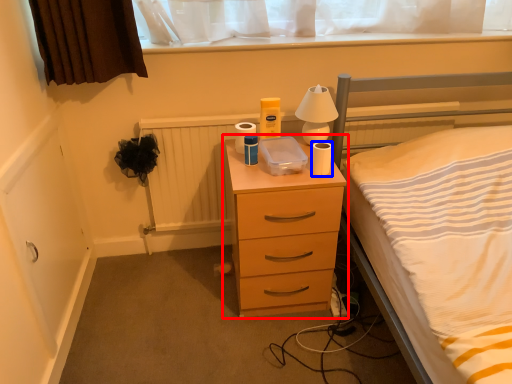
Question: Which point is closer to the camera, chest of drawers (highlighted by a red box) or toilet paper (highlighted by a blue box)?

Choices:
 (A) chest of drawers
 (B) toilet paper

Answer: (A)